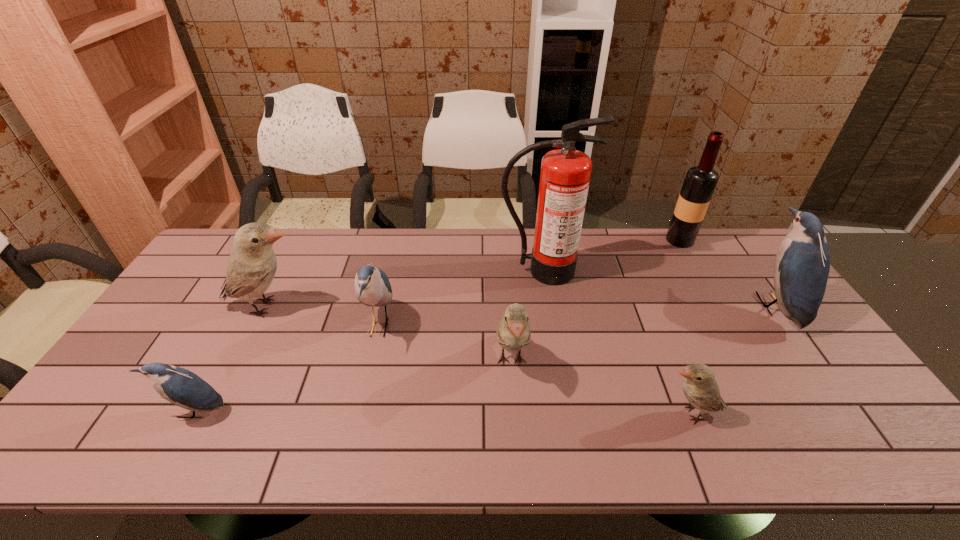
In order to click on the tallest object in this screenshot , I will do `click(565, 174)`.

You are a GUI agent. You are given a task and a screenshot of the screen. Output one action in this format:
    pyautogui.click(x=<x>, y=<y>)
    Task: Click on the fire extinguisher
    
    Given the screenshot: What is the action you would take?
    pyautogui.click(x=565, y=174)

This screenshot has height=540, width=960. Identify the location of the farthest object. (700, 181).

Locate an element on the screen. the seventh object from left to right is located at coordinates (700, 181).

Find the location of a particular element. the biggest blue bird is located at coordinates (802, 264).

Where is `the rightmost object`? the rightmost object is located at coordinates (802, 264).

Locate an element on the screen. the farthest white bird is located at coordinates (252, 264).

The image size is (960, 540). I want to click on the biggest white bird, so click(x=252, y=264).

The height and width of the screenshot is (540, 960). What are the coordinates of `the fourth bird from right to left` in the screenshot? It's located at (372, 286).

The height and width of the screenshot is (540, 960). Find the location of `the second biggest blue bird`. the second biggest blue bird is located at coordinates (372, 286).